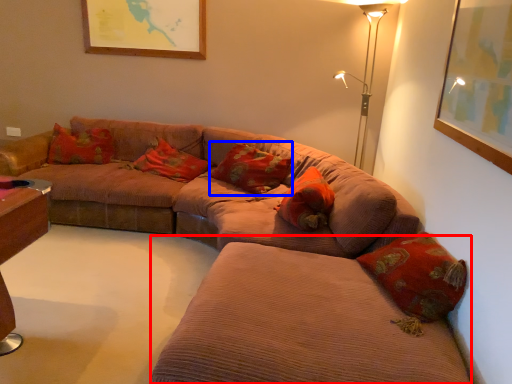
Question: Which of the following is the farthest to the observer, couch (highlighted by a red box) or pillow (highlighted by a blue box)?

Choices:
 (A) couch
 (B) pillow

Answer: (B)